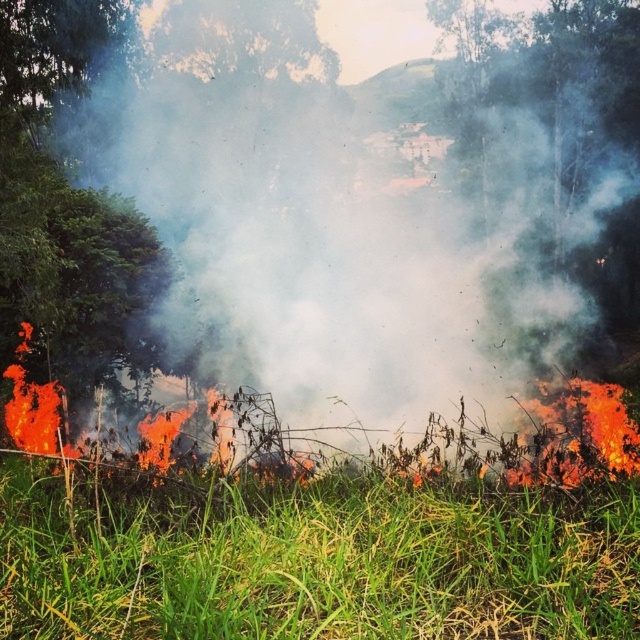
You are a firefighter trying to assess the direction of the wildfire. You notice a white smoke at center. Based on its position, can you determine the direction the fire is spreading? Please explain your reasoning.

The white smoke at center is located at coordinates point (352, 234), which indicates it is in the central area of the scene. However, without additional information about wind direction or the fire front movement, it is not possible to determine the exact direction the fire is spreading based solely on the position of the smoke.

You are a firefighter assessing the wildfire scene. You notice the white smoke at center and the green grass at lower center. Based on their positions, which object is closer to the ground?

The green grass at lower center is closer to the ground because it is positioned below the white smoke at center.